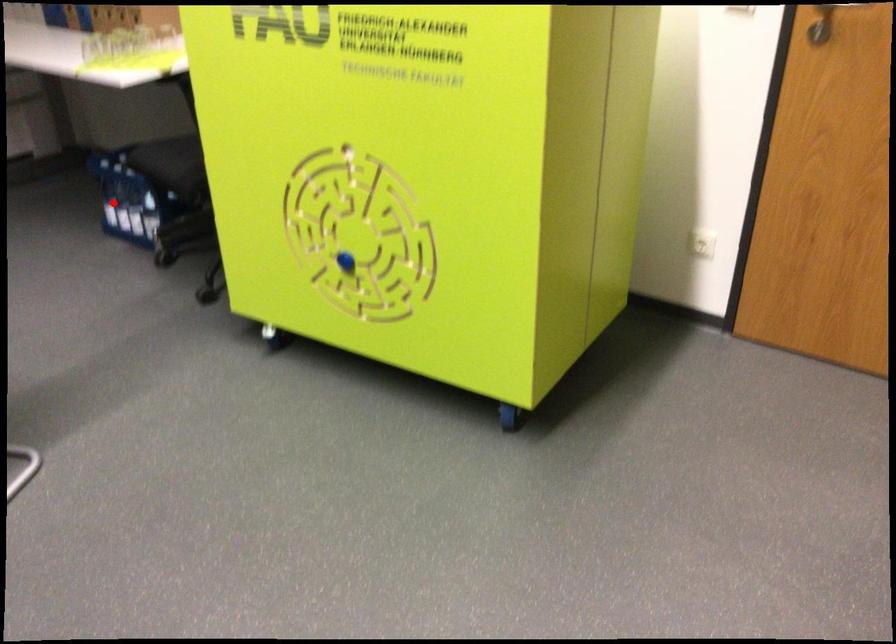
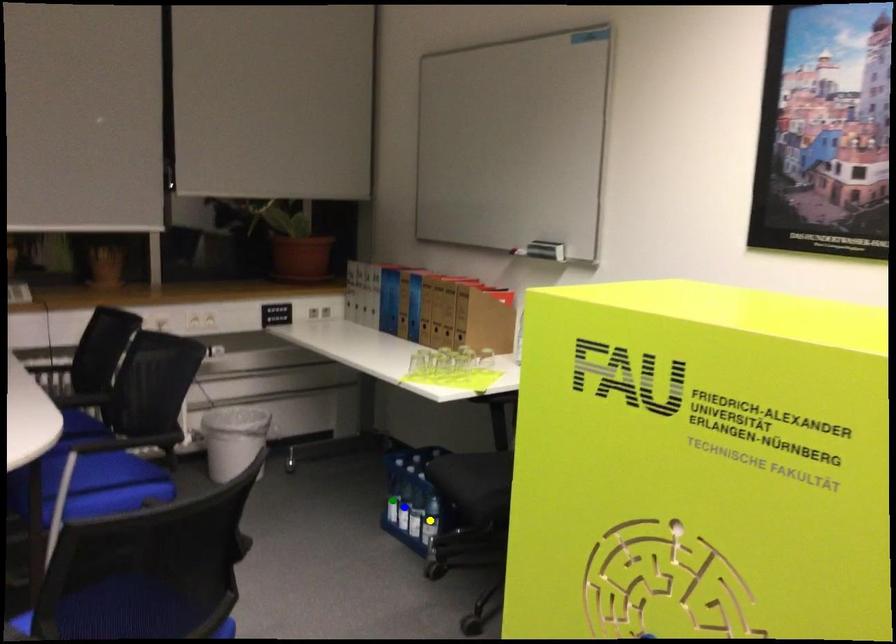
Question: I am providing you with two images of the same scene from different viewpoints. A red point is marked on the first image. You are given multiple points on the second image. Which mark in image 2 goes with the point in image 1?

Choices:
 (A) blue point
 (B) green point
 (C) yellow point

Answer: (B)